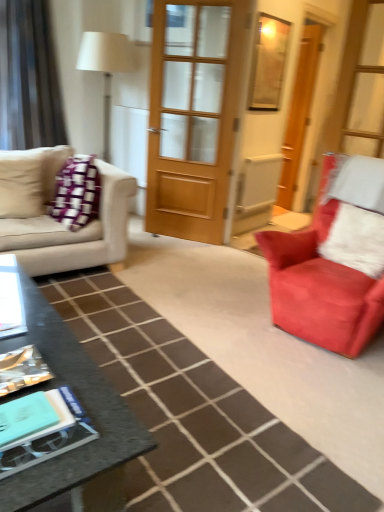
Question: From the image's perspective, is smooth black coffee table at center on top of white fluffy pillow at right?

Choices:
 (A) no
 (B) yes

Answer: (A)

Question: Is smooth black coffee table at center next to white fluffy pillow at right and touching it?

Choices:
 (A) yes
 (B) no

Answer: (B)

Question: From a real-world perspective, is smooth black coffee table at center positioned under white fluffy pillow at right based on gravity?

Choices:
 (A) no
 (B) yes

Answer: (B)

Question: Does smooth black coffee table at center appear on the left side of white fluffy pillow at right?

Choices:
 (A) yes
 (B) no

Answer: (A)

Question: Can you confirm if smooth black coffee table at center is positioned to the right of white fluffy pillow at right?

Choices:
 (A) no
 (B) yes

Answer: (A)

Question: Is granite black coffee table at lower left bigger or smaller than smooth black coffee table at center?

Choices:
 (A) small
 (B) big

Answer: (B)

Question: From the image's perspective, is granite black coffee table at lower left positioned above or below smooth black coffee table at center?

Choices:
 (A) below
 (B) above

Answer: (B)

Question: Considering their positions, is granite black coffee table at lower left located in front of or behind smooth black coffee table at center?

Choices:
 (A) behind
 (B) front

Answer: (A)

Question: Is granite black coffee table at lower left situated inside smooth black coffee table at center or outside?

Choices:
 (A) inside
 (B) outside

Answer: (B)

Question: Considering the positions of point (34, 271) and point (256, 40), is point (34, 271) closer or farther from the camera than point (256, 40)?

Choices:
 (A) closer
 (B) farther

Answer: (A)

Question: From a real-world perspective, is beige fabric couch at left above or below wooden frame at upper center?

Choices:
 (A) below
 (B) above

Answer: (A)

Question: From the image's perspective, is beige fabric couch at left positioned above or below wooden frame at upper center?

Choices:
 (A) below
 (B) above

Answer: (A)

Question: Considering the positions of beige fabric couch at left and wooden frame at upper center in the image, is beige fabric couch at left bigger or smaller than wooden frame at upper center?

Choices:
 (A) small
 (B) big

Answer: (B)

Question: In the image, is white fluffy pillow at right positioned in front of or behind wooden door at center, acting as the 2th door starting from the front?

Choices:
 (A) front
 (B) behind

Answer: (A)

Question: From the image's perspective, is white fluffy pillow at right positioned above or below wooden door at center, which ranks as the 2th door in left-to-right order?

Choices:
 (A) above
 (B) below

Answer: (B)